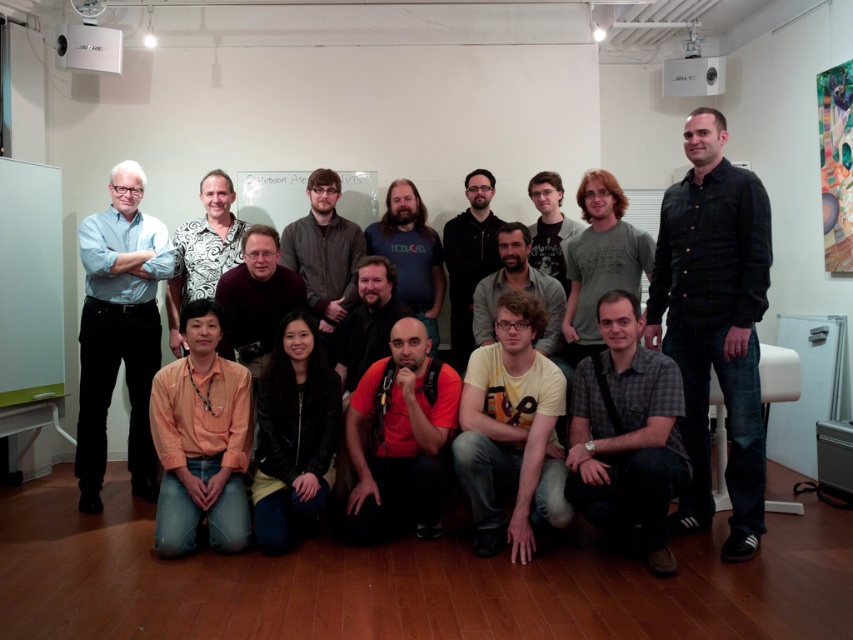
Is black denim shirt at right wider than gray checkered shirt at lower center?

In fact, black denim shirt at right might be narrower than gray checkered shirt at lower center.

In the scene shown: Can you confirm if black denim shirt at right is positioned below gray checkered shirt at lower center?

No, black denim shirt at right is not below gray checkered shirt at lower center.

Is point (733, 500) closer to viewer compared to point (584, 378)?

Yes, it is.

At what (x,y) coordinates should I click in order to perform the action: click on black denim shirt at right. Please return your answer as a coordinate pair (x, y). Looking at the image, I should click on (714, 323).

Does matte black shirt at center appear over black matte shirt at center?

Incorrect, matte black shirt at center is not positioned above black matte shirt at center.

Based on the photo, who is higher up, matte black shirt at center or black matte shirt at center?

black matte shirt at center

Where is `matte black shirt at center`? Image resolution: width=853 pixels, height=640 pixels. matte black shirt at center is located at coordinates (712, 326).

Where is `matte black shirt at center`? This screenshot has width=853, height=640. matte black shirt at center is located at coordinates (712, 326).

Is point (764, 220) behind point (125, 337)?

No, (764, 220) is in front of (125, 337).

Can you confirm if black denim shirt at right is positioned to the right of light blue shirt at left?

Correct, you'll find black denim shirt at right to the right of light blue shirt at left.

The width and height of the screenshot is (853, 640). What are the coordinates of `black denim shirt at right` in the screenshot? It's located at (714, 323).

What are the coordinates of `black denim shirt at right` in the screenshot? It's located at coord(714,323).